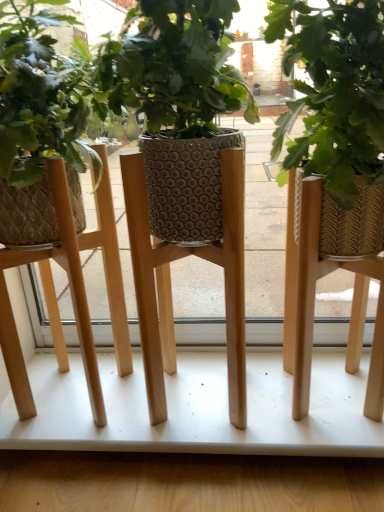
Question: Would you say wooden table at center is inside or outside wooden stool at center?

Choices:
 (A) inside
 (B) outside

Answer: (B)

Question: Considering the relative positions of wooden table at center and wooden stool at center in the image provided, is wooden table at center to the left or to the right of wooden stool at center?

Choices:
 (A) right
 (B) left

Answer: (A)

Question: Which of these objects is positioned closest to the woven straw planter at center?

Choices:
 (A) wooden stool at center
 (B) wooden table at center

Answer: (B)

Question: Based on their relative distances, which object is farther from the wooden stool at center?

Choices:
 (A) wooden table at center
 (B) woven straw planter at center

Answer: (B)